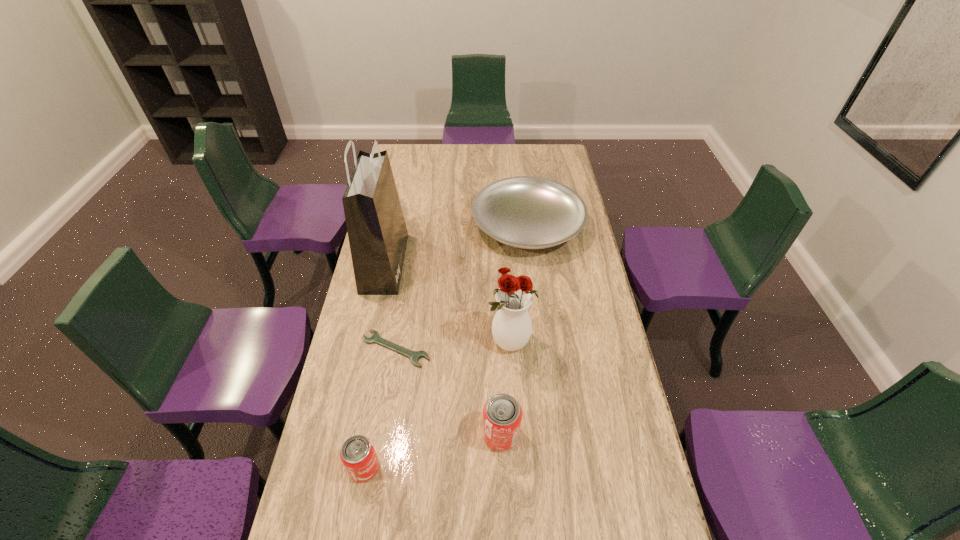
Where is `vacant point that satisfies the following two spatial constraints: 1. on the front side of the wrench; 2. on the left side of the fourth shortest object`? The image size is (960, 540). vacant point that satisfies the following two spatial constraints: 1. on the front side of the wrench; 2. on the left side of the fourth shortest object is located at coordinates (382, 435).

At what (x,y) coordinates should I click in order to perform the action: click on vacant space that satisfies the following two spatial constraints: 1. on the back side of the fifth shortest object; 2. on the front with handles of the shopping bag. Please return your answer as a coordinate pair (x, y). This screenshot has height=540, width=960. Looking at the image, I should click on (505, 263).